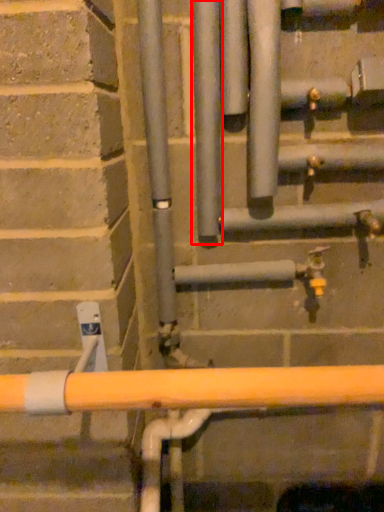
Question: Considering the relative positions of pipe (annotated by the red box) and pipe in the image provided, where is pipe (annotated by the red box) located with respect to the staircase?

Choices:
 (A) left
 (B) right

Answer: (A)